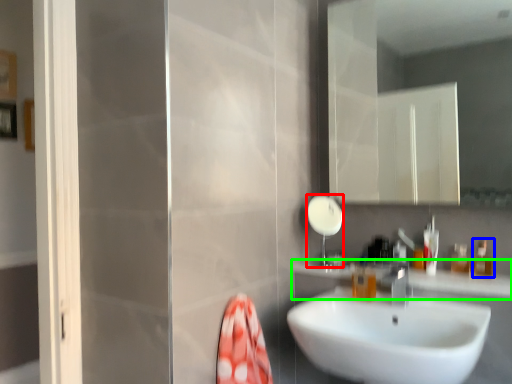
Question: Which is farther away from shower (highlighted by a red box)? toiletry (highlighted by a blue box) or counter top (highlighted by a green box)?

Choices:
 (A) toiletry
 (B) counter top

Answer: (A)